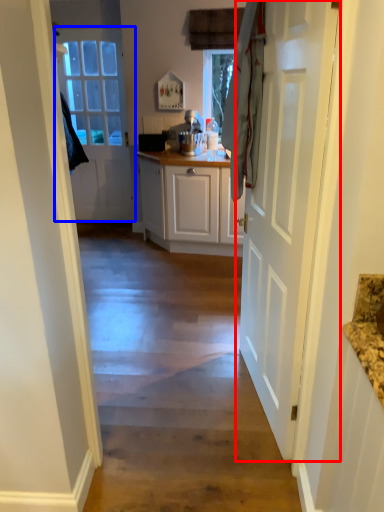
Question: Which object appears farthest to the camera in this image, door (highlighted by a red box) or door (highlighted by a blue box)?

Choices:
 (A) door
 (B) door

Answer: (B)